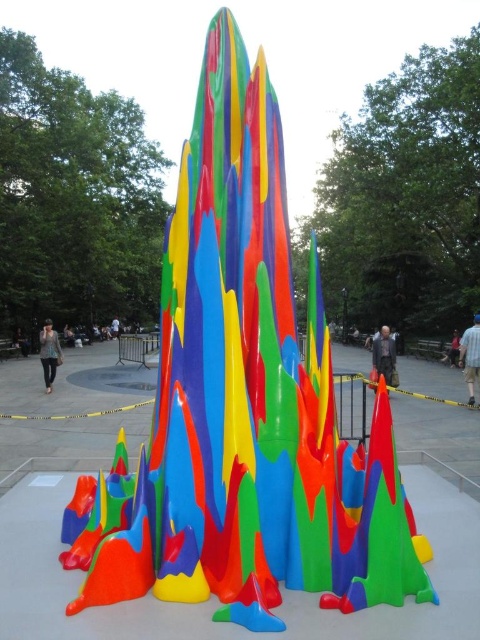
Does denim jacket at lower left have a lesser height compared to matte black person at center?

No.

This screenshot has height=640, width=480. What do you see at coordinates (48, 353) in the screenshot?
I see `denim jacket at lower left` at bounding box center [48, 353].

Between point (51, 376) and point (111, 330), which one is positioned in front?

Point (51, 376) is more forward.

Where is `denim jacket at lower left`? The height and width of the screenshot is (640, 480). denim jacket at lower left is located at coordinates (48, 353).

Is matte black person at lower left positioned at the back of matte black jacket at upper center?

Yes, matte black person at lower left is further from the viewer.

Which is behind, point (19, 346) or point (450, 362)?

The point (19, 346) is more distant.

Where is `matte black person at lower left`? matte black person at lower left is located at coordinates tap(21, 340).

Describe the element at coordinates (381, 531) in the screenshot. I see `glossy plastic cone at center` at that location.

What do you see at coordinates (381, 531) in the screenshot? The width and height of the screenshot is (480, 640). I see `glossy plastic cone at center` at bounding box center [381, 531].

This screenshot has height=640, width=480. Identify the location of glossy plastic cone at center. (381, 531).